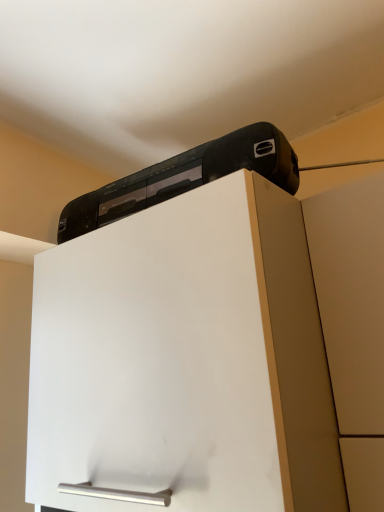
The image size is (384, 512). What do you see at coordinates (185, 177) in the screenshot?
I see `black matte speaker at upper center` at bounding box center [185, 177].

In order to click on black matte speaker at upper center in this screenshot , I will do pyautogui.click(x=185, y=177).

The height and width of the screenshot is (512, 384). What are the coordinates of `black matte speaker at upper center` in the screenshot? It's located at (185, 177).